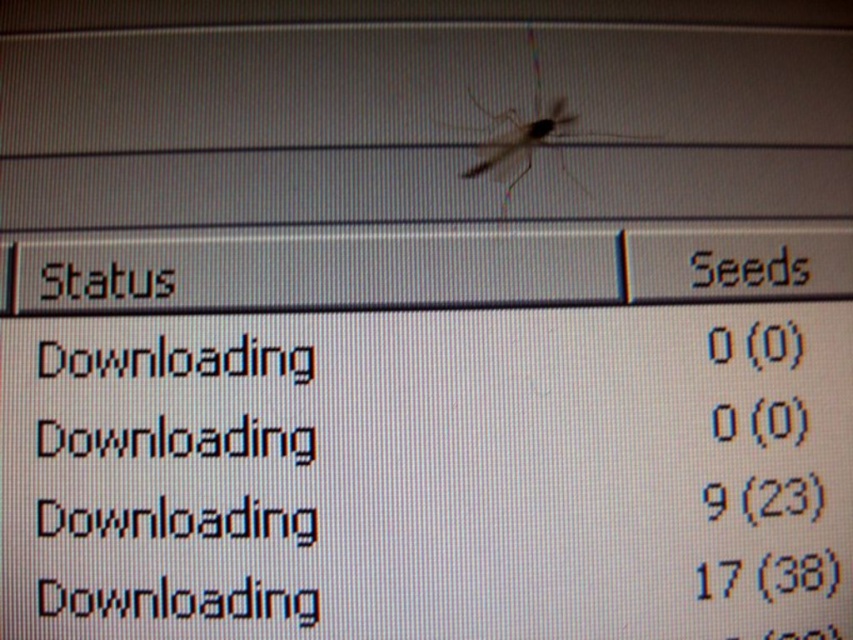
You are using a file sharing app and see the translucent glass mosquito at center and the black pixelated number at center on the screen. Which one takes up more space on the screen?

The translucent glass mosquito at center is bigger than the black pixelated number at center, so it takes up more space on the screen.

You are looking at the computer screen and notice a translucent glass mosquito at center and a black digital number at center. Which object appears larger in height on the screen?

The translucent glass mosquito at center is taller than the black digital number at center.